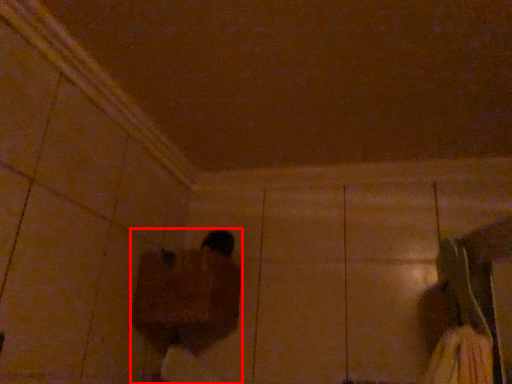
Question: From the image, what is the correct spatial relationship of person (annotated by the red box) in relation to footwear?

Choices:
 (A) right
 (B) left

Answer: (B)